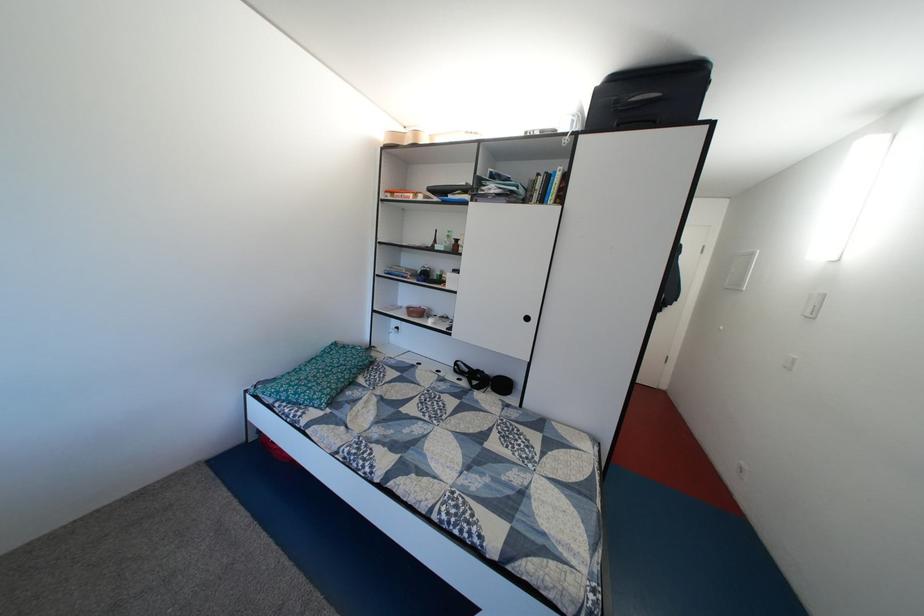
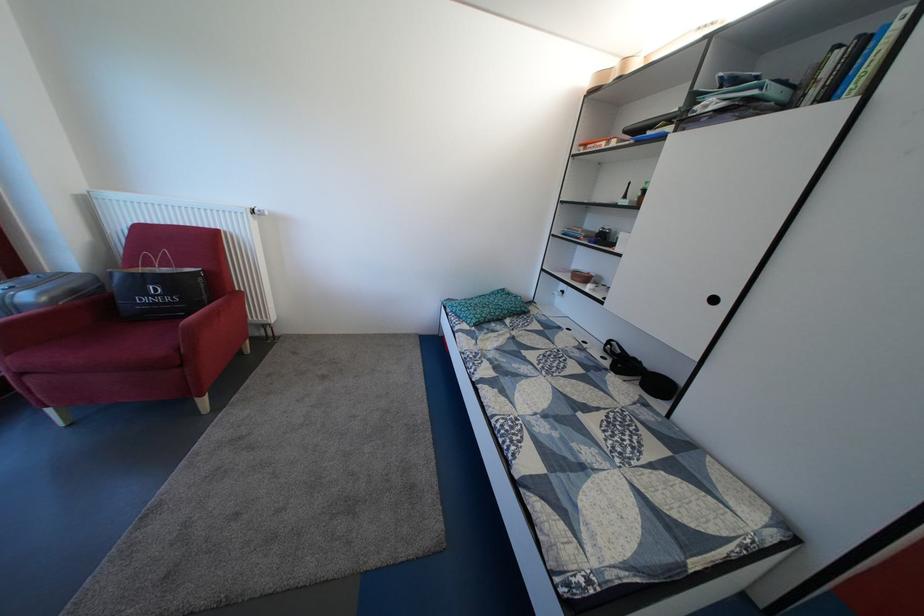
In the second image, find the point that corresponds to point (408, 334) in the first image.

(574, 299)